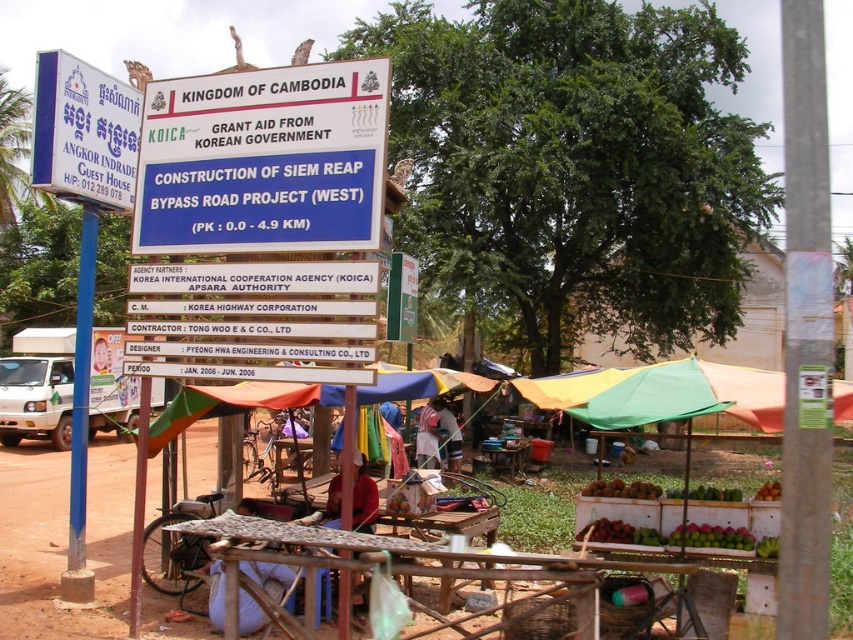
Question: Is white plastic sign at upper left bigger than blue painted metal pole at left?

Choices:
 (A) yes
 (B) no

Answer: (B)

Question: Is blue plastic sign at upper center thinner than white plastic sign at center?

Choices:
 (A) yes
 (B) no

Answer: (B)

Question: Which of the following is the closest to the observer?

Choices:
 (A) (35, 150)
 (B) (341, 99)
 (C) (396, 323)
 (D) (91, 314)

Answer: (B)

Question: Is white plastic sign at upper left smaller than blue painted metal pole at left?

Choices:
 (A) no
 (B) yes

Answer: (B)

Question: Which point is farther from the camera taking this photo?

Choices:
 (A) (123, 97)
 (B) (70, 522)
 (C) (331, 200)

Answer: (A)

Question: Which point is farther to the camera?

Choices:
 (A) tap(88, 259)
 (B) tap(248, 230)

Answer: (A)